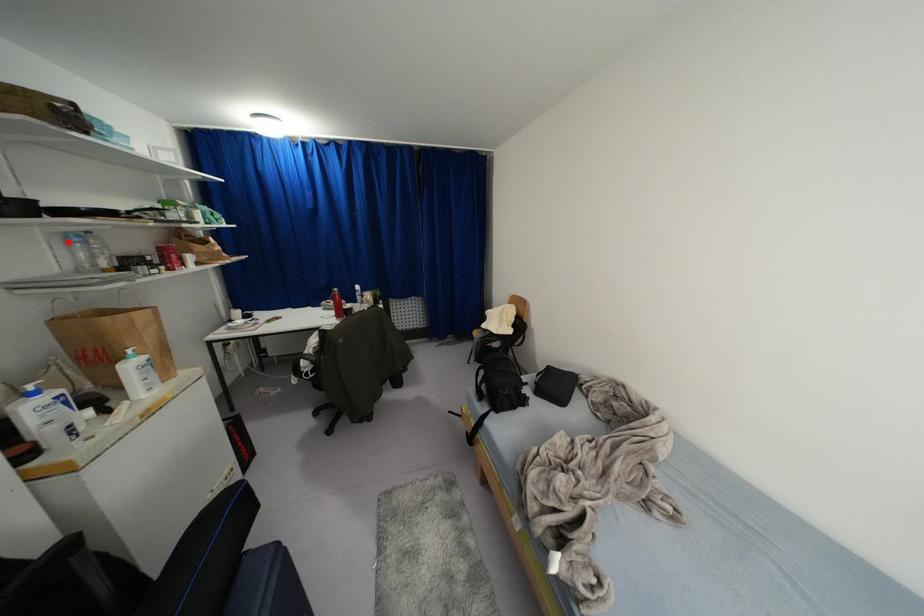
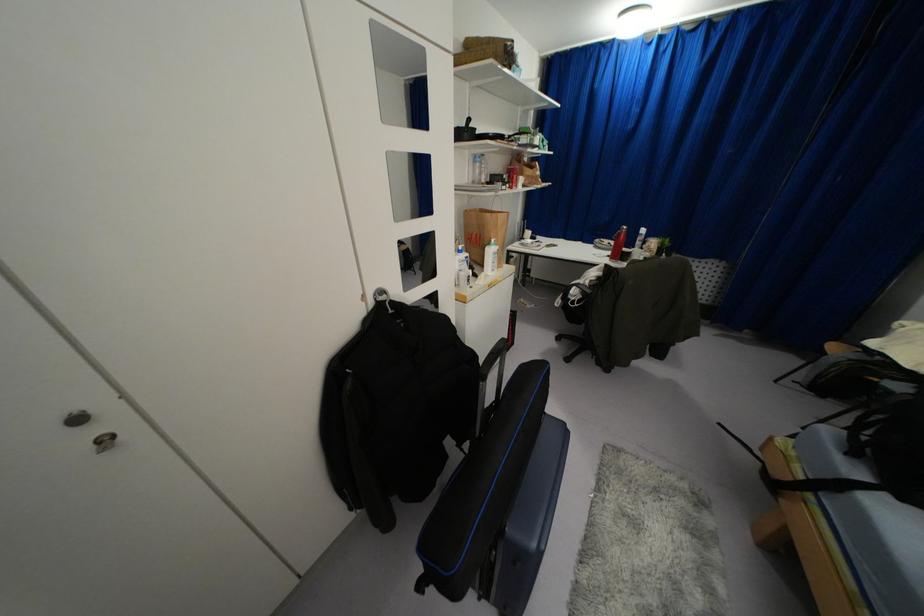
Locate, in the second image, the point that corresponds to the highlighted location in the first image.

(475, 161)